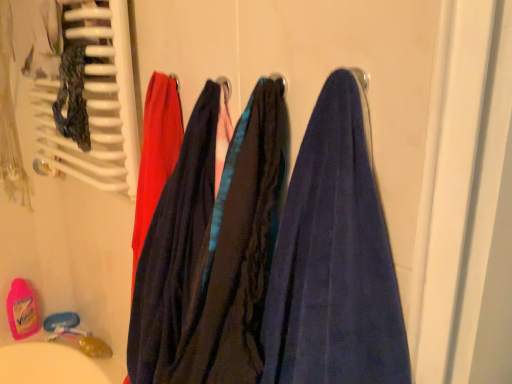
This screenshot has height=384, width=512. I want to click on velvet-like fabric pants at center, so click(x=211, y=254).

The width and height of the screenshot is (512, 384). Describe the element at coordinates (211, 254) in the screenshot. I see `velvet-like fabric pants at center` at that location.

The width and height of the screenshot is (512, 384). Identify the location of velvet-like fabric pants at center. (211, 254).